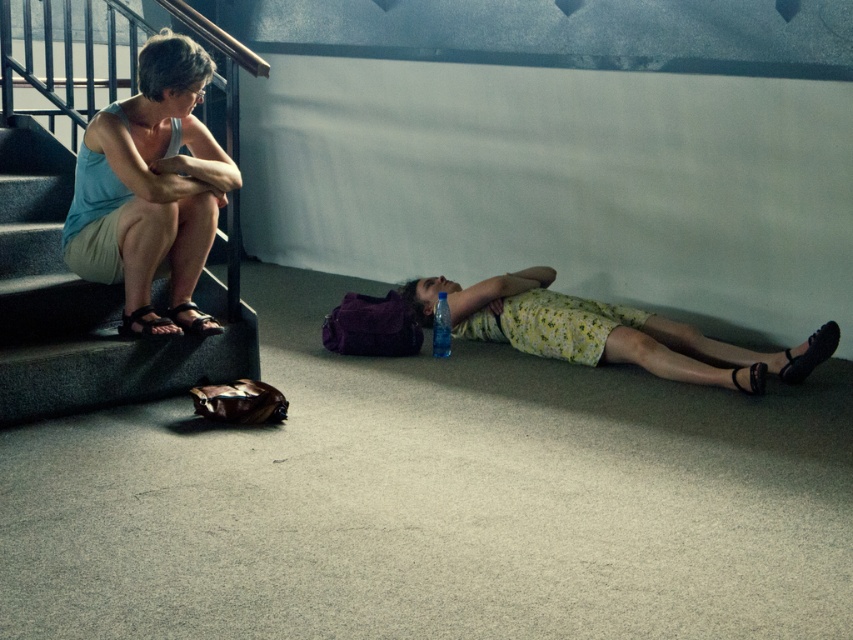
You are a security guard in the building and you see the light blue fabric tank top at upper left. Where exactly is it located in the image?

The light blue fabric tank top at upper left is located at point (149,179).

You are a security guard in the building and you see the black fabric sandal at lower right and the black leather sandal at lower right. Which one is bigger in size?

The black fabric sandal at lower right is larger in size than the black leather sandal at lower right.

You are standing at the point labeled as point (525, 339) in the image. You want to walk to the nearest exit, which is located 5 meters away from your current position. Can you reach the exit without moving more than 5 meters?

The distance between point (525, 339) and the viewer is 4.97 meters, so yes, you can reach the exit without moving more than 5 meters since the distance is slightly less than the required 5 meters.